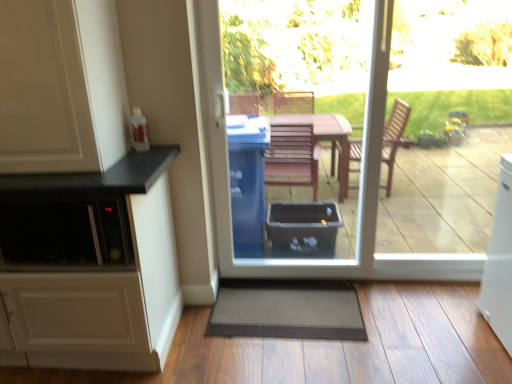
Question: Is white matte cabinet at left, marked as the second cabinetry in a bottom-to-top arrangement, next to white matte cabinet at left, which appears as the 2th cabinetry when viewed from the top?

Choices:
 (A) yes
 (B) no

Answer: (B)

Question: Is white matte cabinet at left, marked as the second cabinetry in a bottom-to-top arrangement, facing away from white matte cabinet at left, which appears as the 2th cabinetry when viewed from the top?

Choices:
 (A) no
 (B) yes

Answer: (A)

Question: Is white matte cabinet at left, marked as the second cabinetry in a bottom-to-top arrangement, thinner than white matte cabinet at left, marked as the 1th cabinetry in a bottom-to-top arrangement?

Choices:
 (A) no
 (B) yes

Answer: (B)

Question: Is there a large distance between white matte cabinet at left, the 1th cabinetry positioned from the top, and white matte cabinet at left, which appears as the 2th cabinetry when viewed from the top?

Choices:
 (A) no
 (B) yes

Answer: (A)

Question: Is white matte cabinet at left, marked as the second cabinetry in a bottom-to-top arrangement, outside white matte cabinet at left, marked as the 1th cabinetry in a bottom-to-top arrangement?

Choices:
 (A) yes
 (B) no

Answer: (A)

Question: From a real-world perspective, does white matte cabinet at left, the 1th cabinetry positioned from the top, stand above white matte cabinet at left, which appears as the 2th cabinetry when viewed from the top?

Choices:
 (A) no
 (B) yes

Answer: (B)

Question: From the image's perspective, is transparent plastic bin at center beneath gray textured mat at lower center?

Choices:
 (A) yes
 (B) no

Answer: (B)

Question: Considering the relative sizes of transparent plastic bin at center and gray textured mat at lower center in the image provided, is transparent plastic bin at center taller than gray textured mat at lower center?

Choices:
 (A) no
 (B) yes

Answer: (B)

Question: Considering the relative positions of transparent plastic bin at center and gray textured mat at lower center in the image provided, is transparent plastic bin at center to the left of gray textured mat at lower center from the viewer's perspective?

Choices:
 (A) yes
 (B) no

Answer: (B)

Question: Are transparent plastic bin at center and gray textured mat at lower center located far from each other?

Choices:
 (A) yes
 (B) no

Answer: (B)

Question: From the image's perspective, is transparent plastic bin at center on top of gray textured mat at lower center?

Choices:
 (A) no
 (B) yes

Answer: (B)

Question: Considering the relative sizes of transparent plastic bin at center and gray textured mat at lower center in the image provided, is transparent plastic bin at center bigger than gray textured mat at lower center?

Choices:
 (A) no
 (B) yes

Answer: (B)

Question: From a real-world perspective, is white matte cabinet at left, which appears as the 2th cabinetry when viewed from the top, on top of gray textured mat at lower center?

Choices:
 (A) no
 (B) yes

Answer: (B)